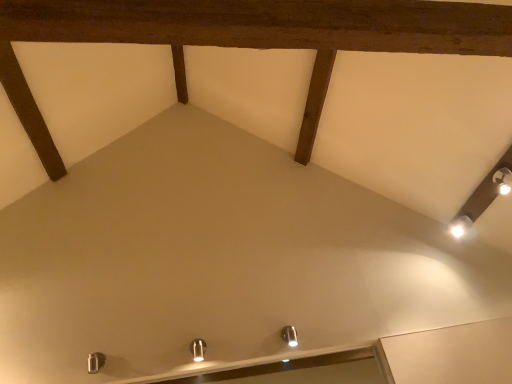
Question: Can you confirm if white glossy light fixture at upper right, marked as the 1th light fixture in a top-to-bottom arrangement, is thinner than metallic silver light fixture at center, positioned as the third light fixture in top-to-bottom order?

Choices:
 (A) yes
 (B) no

Answer: (B)

Question: Considering the relative sizes of white glossy light fixture at upper right, marked as the 1th light fixture in a top-to-bottom arrangement, and metallic silver light fixture at center, the 1th light fixture when ordered from left to right, in the image provided, is white glossy light fixture at upper right, marked as the 1th light fixture in a top-to-bottom arrangement, wider than metallic silver light fixture at center, the 1th light fixture when ordered from left to right,?

Choices:
 (A) no
 (B) yes

Answer: (B)

Question: Is white glossy light fixture at upper right, which is counted as the 3th light fixture, starting from the front, to the left of metallic silver light fixture at center, the 1th light fixture when ordered from left to right, from the viewer's perspective?

Choices:
 (A) no
 (B) yes

Answer: (A)

Question: From a real-world perspective, is white glossy light fixture at upper right, the third light fixture in the left-to-right sequence, over metallic silver light fixture at center, the 1th light fixture when ordered from left to right?

Choices:
 (A) yes
 (B) no

Answer: (A)

Question: Does white glossy light fixture at upper right, which is the first light fixture from right to left, have a lesser height compared to metallic silver light fixture at center, positioned as the third light fixture in top-to-bottom order?

Choices:
 (A) no
 (B) yes

Answer: (B)

Question: From the image's perspective, is white glossy light fixture at upper right, which is the first light fixture from right to left, located above metallic silver light fixture at center, the 1th light fixture when ordered from left to right?

Choices:
 (A) no
 (B) yes

Answer: (B)

Question: Can you confirm if metallic silver light fixture at center, positioned as the third light fixture in top-to-bottom order, is bigger than white glossy light fixture at upper right, the third light fixture in the left-to-right sequence?

Choices:
 (A) yes
 (B) no

Answer: (B)

Question: Is metallic silver light fixture at center, which is the 3th light fixture from right to left, positioned beyond the bounds of white glossy light fixture at upper right, which ranks as the 1th light fixture in back-to-front order?

Choices:
 (A) yes
 (B) no

Answer: (A)

Question: From a real-world perspective, is metallic silver light fixture at center, which is the 3th light fixture from right to left, beneath white glossy light fixture at upper right, marked as the 1th light fixture in a top-to-bottom arrangement?

Choices:
 (A) no
 (B) yes

Answer: (B)

Question: Are metallic silver light fixture at center, placed as the first light fixture when sorted from front to back, and white glossy light fixture at upper right, which is counted as the 3th light fixture, starting from the front, beside each other?

Choices:
 (A) no
 (B) yes

Answer: (A)

Question: Does metallic silver light fixture at center, marked as the 1th light fixture in a bottom-to-top arrangement, have a greater width compared to white glossy light fixture at upper right, marked as the 1th light fixture in a top-to-bottom arrangement?

Choices:
 (A) no
 (B) yes

Answer: (A)

Question: Is metallic silver light fixture at center, marked as the 1th light fixture in a bottom-to-top arrangement, closer to the viewer compared to white glossy light fixture at upper right, which is counted as the 3th light fixture, starting from the front?

Choices:
 (A) yes
 (B) no

Answer: (A)

Question: Can you confirm if metallic silver light fixture at center, marked as the third light fixture in a back-to-front arrangement, is positioned to the right of satin nickel light fixture at lower center, which ranks as the second light fixture in right-to-left order?

Choices:
 (A) no
 (B) yes

Answer: (A)